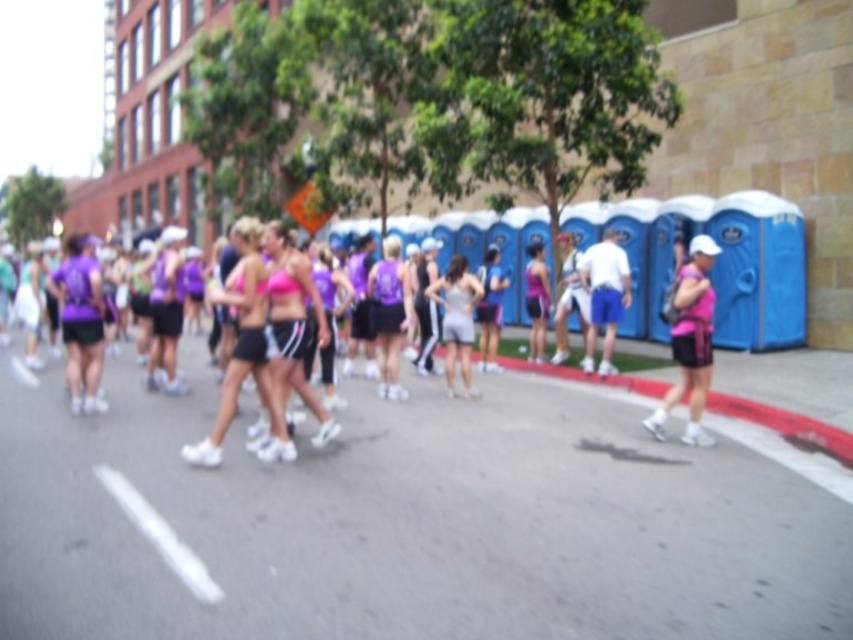
Who is taller, pink matte tank top at center or matte gray tank top at center?

With more height is pink matte tank top at center.

Which is in front, point (643, 422) or point (463, 349)?

Point (643, 422) is more forward.

Who is more forward, (694, 330) or (469, 317)?

Point (694, 330) is more forward.

Identify the location of pink matte tank top at center. (689, 342).

Does pink matte tank top at center appear under purple matte tank top at center?

Correct, pink matte tank top at center is located below purple matte tank top at center.

Is pink matte tank top at center positioned at the back of purple matte tank top at center?

No, pink matte tank top at center is closer to the viewer.

Where is `pink matte tank top at center`? This screenshot has height=640, width=853. pink matte tank top at center is located at coordinates (689, 342).

Locate an element on the screen. pink matte tank top at center is located at coordinates (689, 342).

Consider the image. Is purple matte tank top at center above matte gray tank top at center?

Actually, purple matte tank top at center is below matte gray tank top at center.

What do you see at coordinates (389, 314) in the screenshot?
I see `purple matte tank top at center` at bounding box center [389, 314].

You are a GUI agent. You are given a task and a screenshot of the screen. Output one action in this format:
    pyautogui.click(x=<x>, y=<y>)
    Task: Click on the purple matte tank top at center
    The width and height of the screenshot is (853, 640).
    Given the screenshot: What is the action you would take?
    pyautogui.click(x=389, y=314)